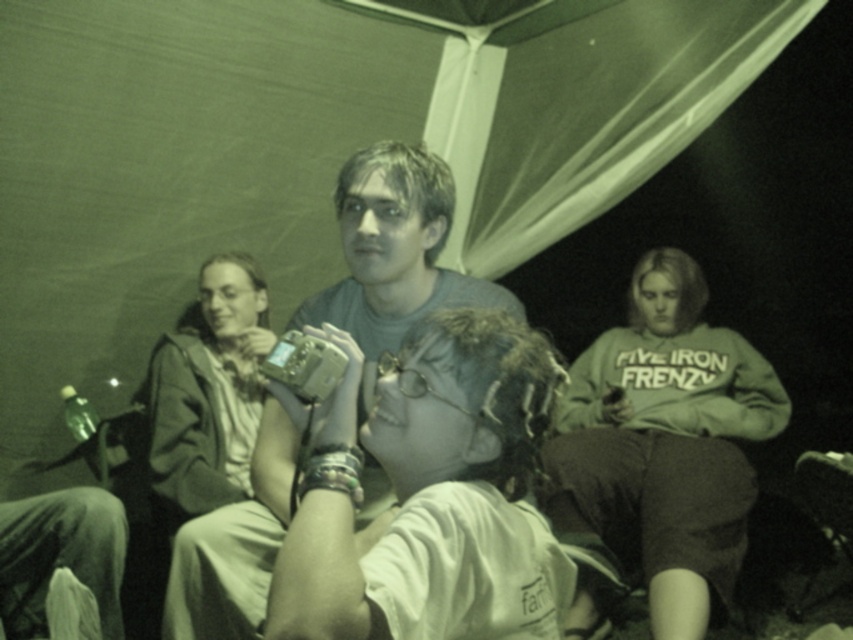
Question: Where is white cotton sweatshirt at right located in relation to matte gray camera at center in the image?

Choices:
 (A) below
 (B) above

Answer: (A)

Question: Is the position of matte silver camera at center more distant than that of matte gray camera at center?

Choices:
 (A) no
 (B) yes

Answer: (A)

Question: Based on their relative distances, which object is nearer to the light brown leather jacket at left?

Choices:
 (A) matte silver camera at center
 (B) white cotton sweatshirt at right

Answer: (B)

Question: Which object is positioned farthest from the white cotton sweatshirt at right?

Choices:
 (A) light brown leather jacket at left
 (B) matte gray camera at center
 (C) matte silver camera at center

Answer: (C)

Question: Among these objects, which one is farthest from the camera?

Choices:
 (A) matte silver camera at center
 (B) white cotton sweatshirt at right

Answer: (B)

Question: Is matte gray camera at center closer to camera compared to light brown leather jacket at left?

Choices:
 (A) no
 (B) yes

Answer: (B)